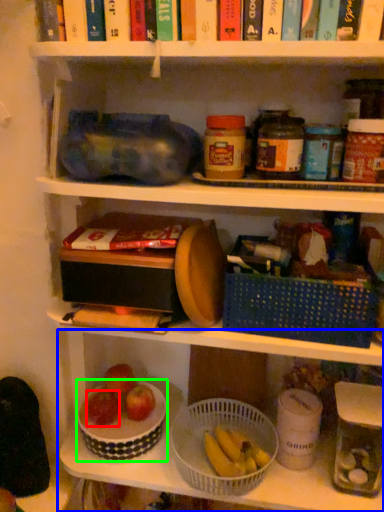
Question: Which object is positioned farthest from apple (highlighted by a red box)? Select from shelf (highlighted by a blue box) and bowl (highlighted by a green box).

Choices:
 (A) shelf
 (B) bowl

Answer: (A)